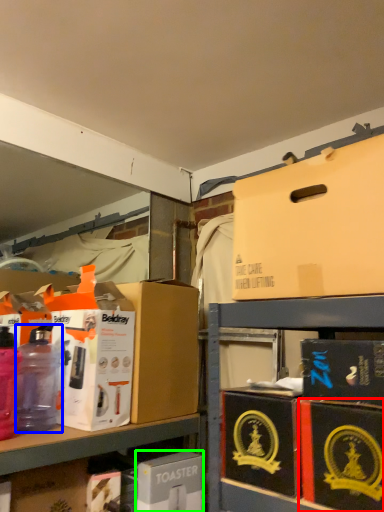
Question: Estimate the real-world distances between objects in this image. Which object is closer to box (highlighted by a red box), bottle (highlighted by a blue box) or box (highlighted by a green box)?

Choices:
 (A) bottle
 (B) box

Answer: (B)